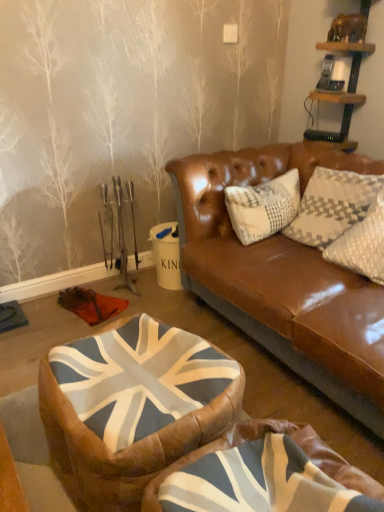
Question: Should I look upward or downward to see wooden shelf at upper right?

Choices:
 (A) up
 (B) down

Answer: (A)

Question: Is union jack fabric bean bag at center, positioned as the 2th bean bag chair in back-to-front order, thinner than union jack fabric bean bag at center, which is the first bean bag chair from back to front?

Choices:
 (A) yes
 (B) no

Answer: (B)

Question: Is there a large distance between union jack fabric bean bag at center, positioned as the 2th bean bag chair in back-to-front order, and union jack fabric bean bag at center, arranged as the 2th bean bag chair when viewed from the front?

Choices:
 (A) no
 (B) yes

Answer: (A)

Question: Considering the relative sizes of union jack fabric bean bag at center, the first bean bag chair from the front, and union jack fabric bean bag at center, arranged as the 2th bean bag chair when viewed from the front, in the image provided, is union jack fabric bean bag at center, the first bean bag chair from the front, bigger than union jack fabric bean bag at center, arranged as the 2th bean bag chair when viewed from the front,?

Choices:
 (A) no
 (B) yes

Answer: (A)

Question: Is union jack fabric bean bag at center, which is the first bean bag chair from back to front, completely or partially inside union jack fabric bean bag at center, the first bean bag chair from the front?

Choices:
 (A) no
 (B) yes

Answer: (A)

Question: Can you confirm if union jack fabric bean bag at center, positioned as the 2th bean bag chair in back-to-front order, is wider than union jack fabric bean bag at center, which is the first bean bag chair from back to front?

Choices:
 (A) yes
 (B) no

Answer: (A)

Question: Does union jack fabric bean bag at center, positioned as the 2th bean bag chair in back-to-front order, have a greater height compared to union jack fabric bean bag at center, which is the first bean bag chair from back to front?

Choices:
 (A) no
 (B) yes

Answer: (B)

Question: Considering the relative positions of union jack fabric bean bag at center, which is the first bean bag chair from back to front, and wooden shelf at upper right in the image provided, is union jack fabric bean bag at center, which is the first bean bag chair from back to front, to the left of wooden shelf at upper right from the viewer's perspective?

Choices:
 (A) no
 (B) yes

Answer: (B)

Question: From a real-world perspective, is union jack fabric bean bag at center, which is the first bean bag chair from back to front, located higher than wooden shelf at upper right?

Choices:
 (A) no
 (B) yes

Answer: (A)

Question: Is union jack fabric bean bag at center, arranged as the 2th bean bag chair when viewed from the front, bigger than wooden shelf at upper right?

Choices:
 (A) no
 (B) yes

Answer: (B)

Question: Is union jack fabric bean bag at center, arranged as the 2th bean bag chair when viewed from the front, not within wooden shelf at upper right?

Choices:
 (A) yes
 (B) no

Answer: (A)

Question: Is union jack fabric bean bag at center, which is the first bean bag chair from back to front, wider than wooden shelf at upper right?

Choices:
 (A) yes
 (B) no

Answer: (A)

Question: Does union jack fabric bean bag at center, which is the first bean bag chair from back to front, have a lesser height compared to wooden shelf at upper right?

Choices:
 (A) no
 (B) yes

Answer: (B)

Question: Is union jack fabric bean bag at center, which is the first bean bag chair from back to front, placed right next to union jack fabric bean bag at center, the first bean bag chair from the front?

Choices:
 (A) no
 (B) yes

Answer: (A)